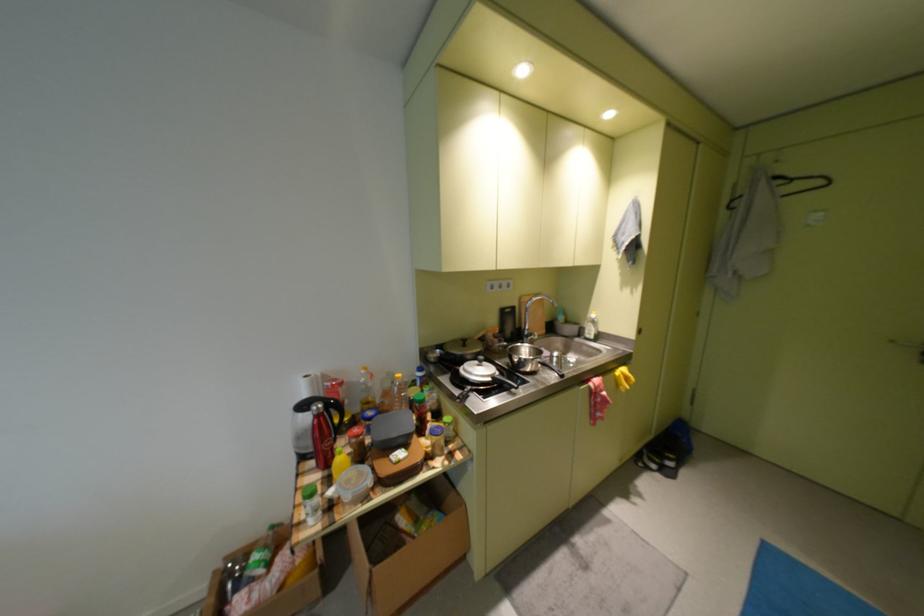
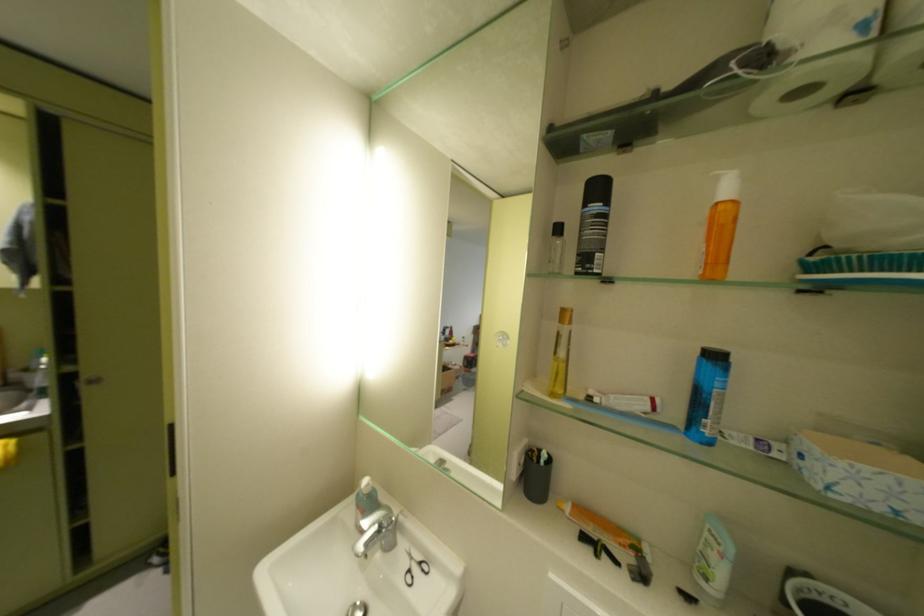
Question: Which direction would the cameraman need to move to produce the second image? Reply with the corresponding letter.

Choices:
 (A) Left
 (B) Right
 (C) Forward
 (D) Backward

Answer: (B)